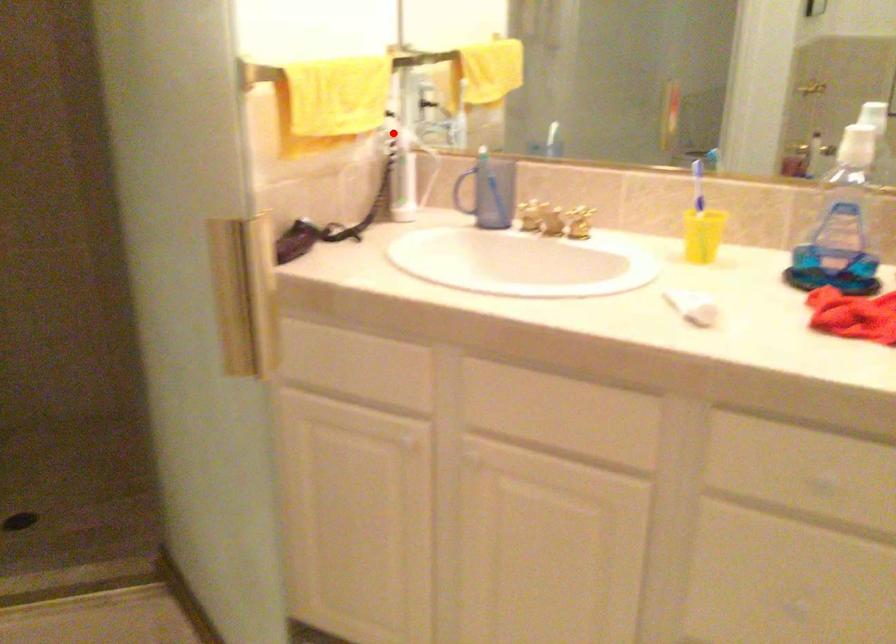
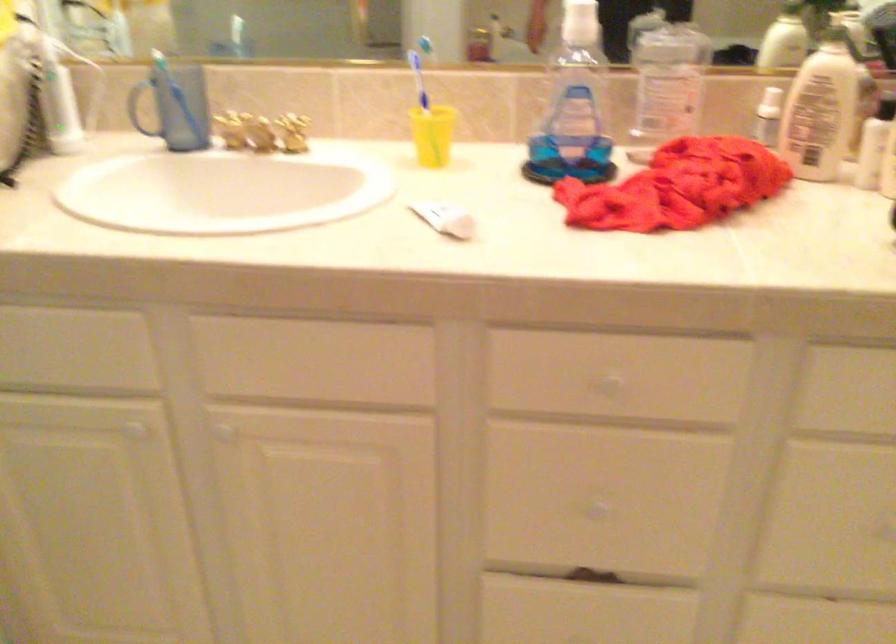
Locate, in the second image, the point that corresponds to the highlighted location in the first image.

(39, 41)